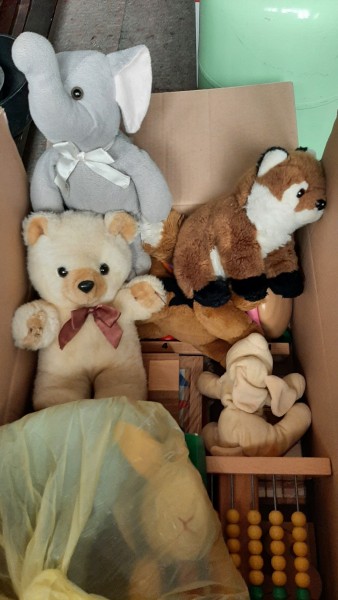
Identify the location of plush toys. The image size is (338, 600). (79, 260), (98, 189), (295, 194), (233, 316), (243, 361).